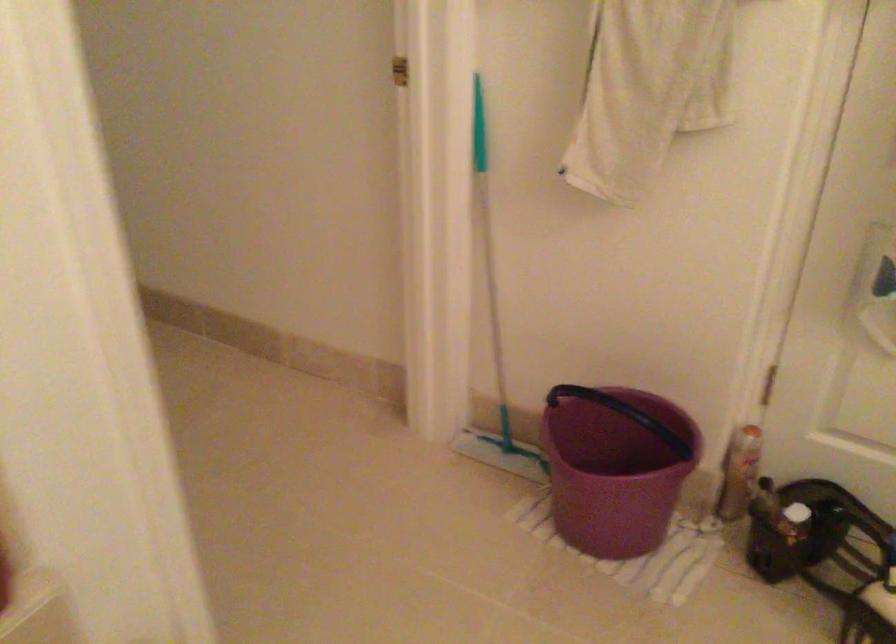
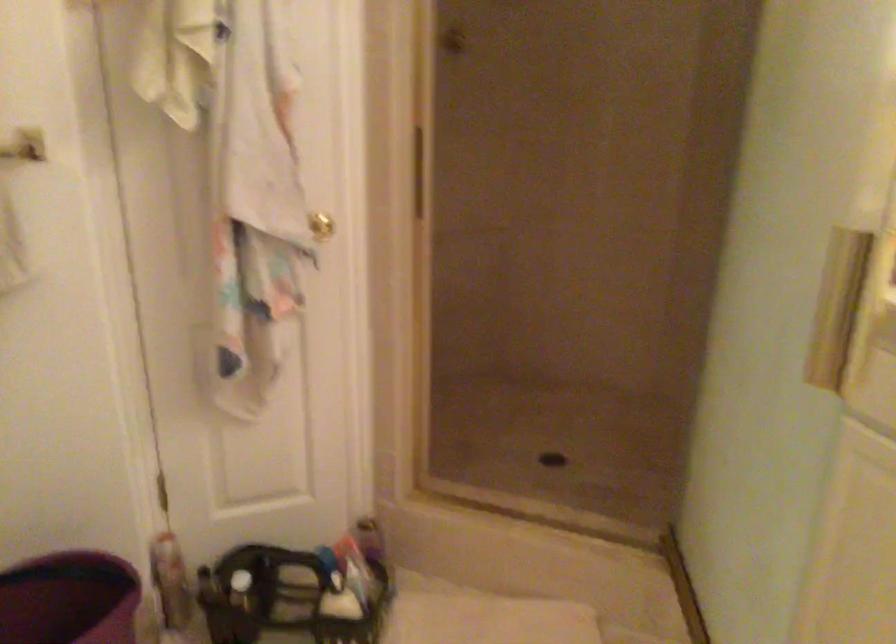
Question: Based on the continuous images, in which direction is the camera rotating? Reply with the corresponding letter.

Choices:
 (A) Left
 (B) Right
 (C) Up
 (D) Down

Answer: (B)